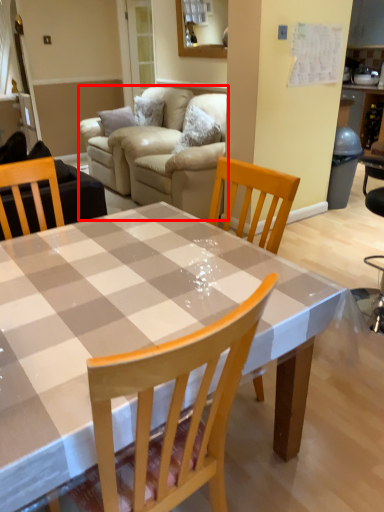
Question: From the image's perspective, considering the relative positions of studio couch (annotated by the red box) and kitchen & dining room table in the image provided, where is studio couch (annotated by the red box) located with respect to the staircase?

Choices:
 (A) below
 (B) above

Answer: (B)